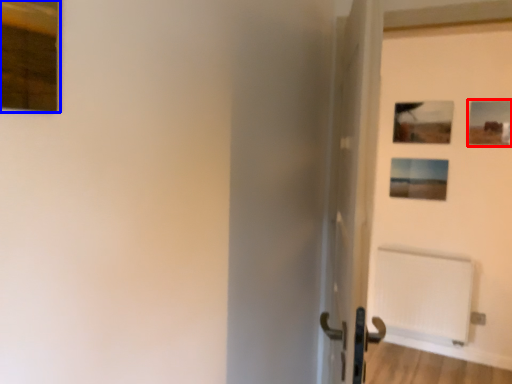
Question: Which point is further to the camera, picture frame (highlighted by a red box) or picture frame (highlighted by a blue box)?

Choices:
 (A) picture frame
 (B) picture frame

Answer: (A)